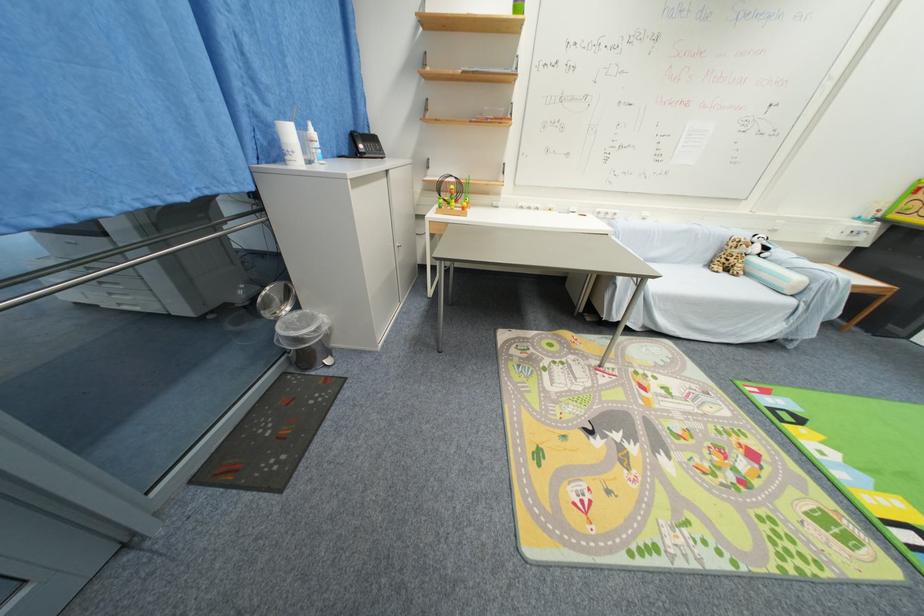
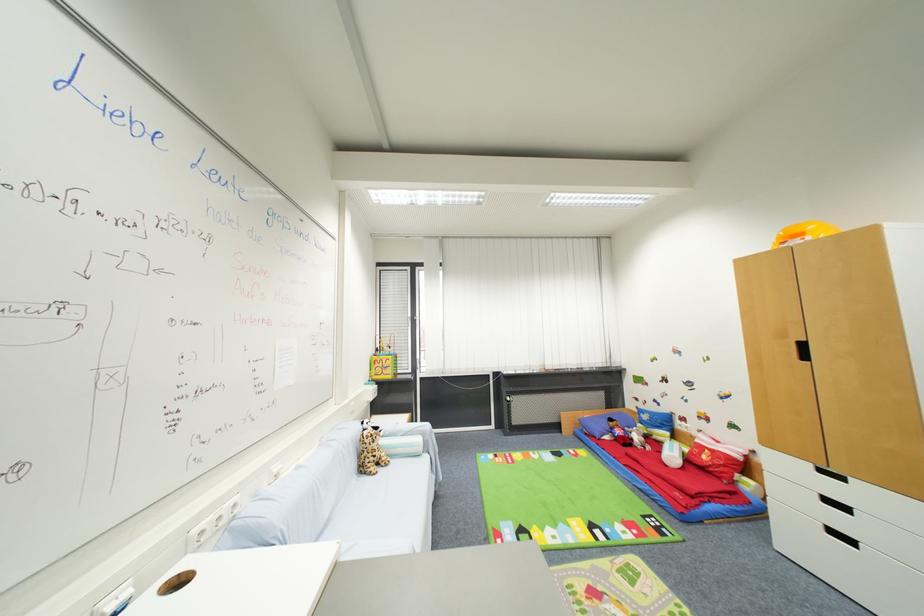
The point at (714, 265) is marked in the first image. Where is the corresponding point in the second image?

(367, 472)